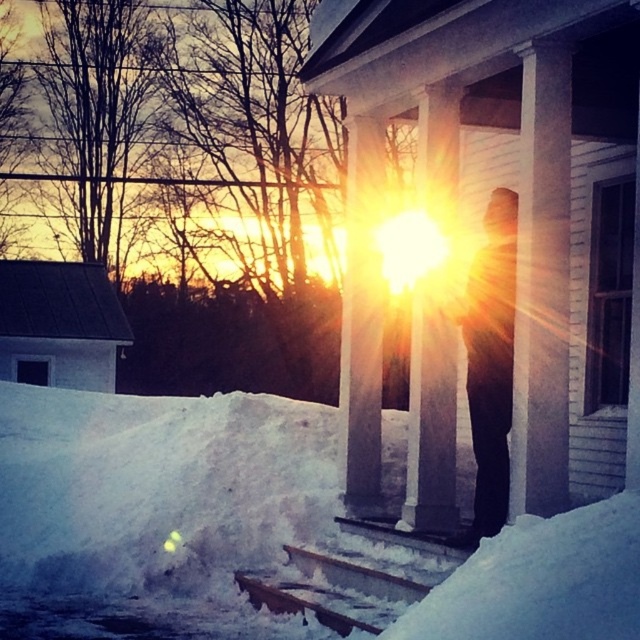
Question: Is white powdery snow at lower left wider than black matte figure at center?

Choices:
 (A) yes
 (B) no

Answer: (A)

Question: Which point appears farthest from the camera in this image?

Choices:
 (A) (58, 509)
 (B) (486, 508)

Answer: (A)

Question: Is white powdery snow at lower left behind black matte figure at center?

Choices:
 (A) yes
 (B) no

Answer: (B)

Question: Which of the following is the closest to the observer?

Choices:
 (A) black matte figure at center
 (B) white powdery snow at lower left

Answer: (B)

Question: Among these points, which one is farthest from the camera?

Choices:
 (A) pos(456,604)
 (B) pos(492,426)

Answer: (B)

Question: Can you confirm if white powdery snow at lower left is wider than black matte figure at center?

Choices:
 (A) no
 (B) yes

Answer: (B)